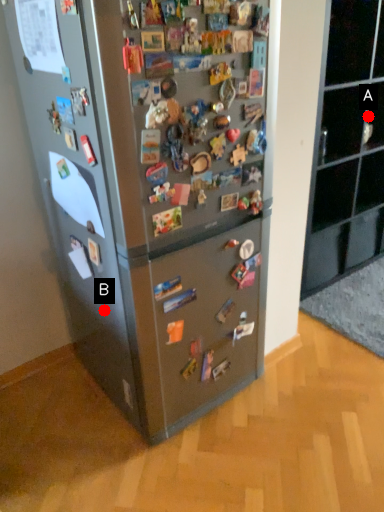
Question: Two points are circled on the image, labeled by A and B beside each circle. Which point is further to the camera?

Choices:
 (A) A is further
 (B) B is further

Answer: (A)